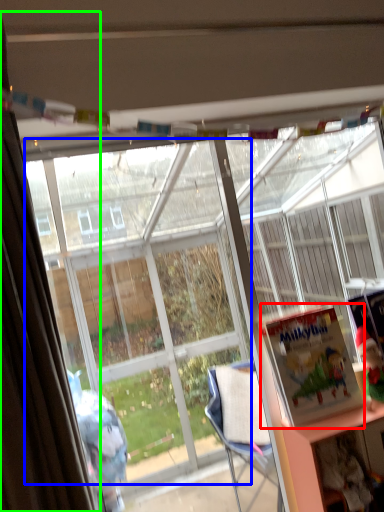
Question: Estimate the real-world distances between objects in this image. Which object is farther from book (highlighted by a red box), bay window (highlighted by a blue box) or curtain (highlighted by a green box)?

Choices:
 (A) bay window
 (B) curtain

Answer: (A)